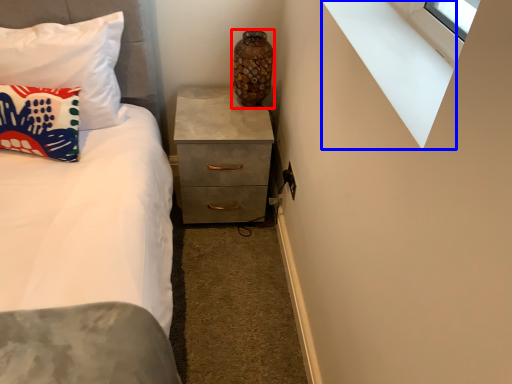
Question: Which object appears farthest to the camera in this image, vase (highlighted by a red box) or window sill (highlighted by a blue box)?

Choices:
 (A) vase
 (B) window sill

Answer: (A)